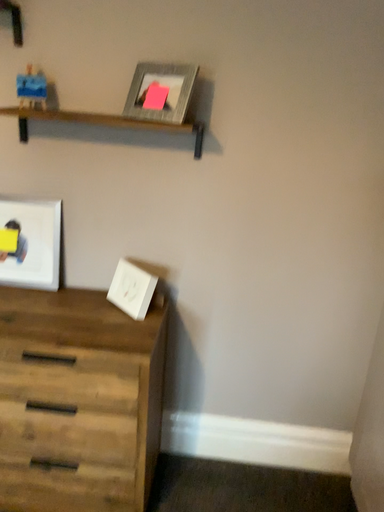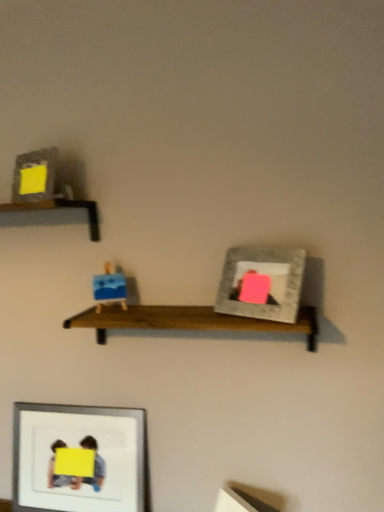
Question: Which way did the camera rotate in the video?

Choices:
 (A) rotated left
 (B) rotated right

Answer: (A)